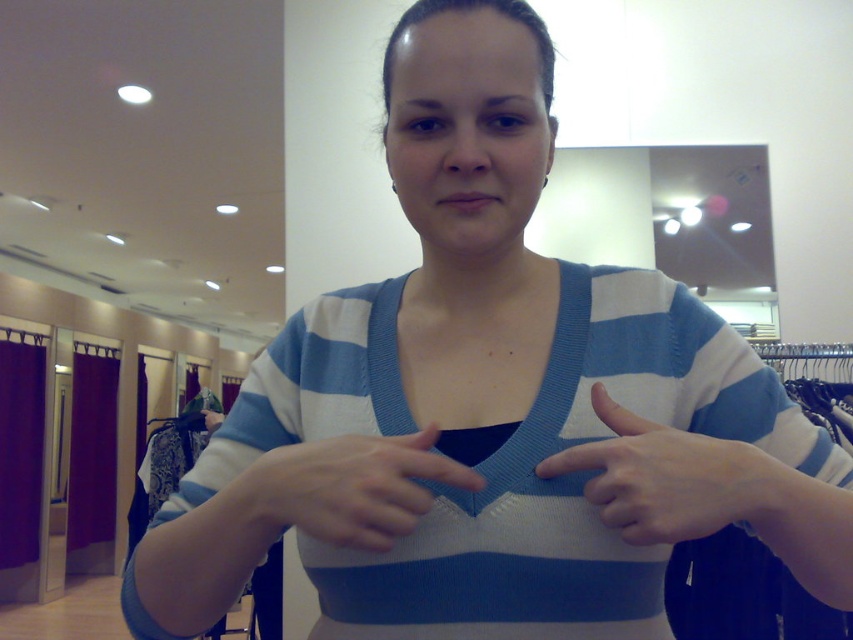
Question: Which of the following is the closest to the observer?

Choices:
 (A) white matte fabric at center
 (B) white knitted hand at center

Answer: (A)

Question: Which object is closer to the camera taking this photo?

Choices:
 (A) white matte fabric at center
 (B) white knitted hand at center

Answer: (A)

Question: Which object appears farthest from the camera in this image?

Choices:
 (A) white matte fabric at center
 (B) white knitted hand at center

Answer: (B)

Question: Is white matte fabric at center bigger than white knitted hand at center?

Choices:
 (A) no
 (B) yes

Answer: (B)

Question: Is white matte fabric at center positioned behind white knitted hand at center?

Choices:
 (A) no
 (B) yes

Answer: (A)

Question: Does white matte fabric at center have a larger size compared to white knitted hand at center?

Choices:
 (A) no
 (B) yes

Answer: (B)